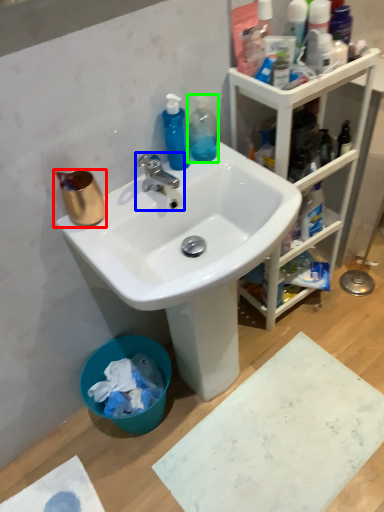
Question: Considering the real-world distances, which object is farthest from coffee cup (highlighted by a red box)? tap (highlighted by a blue box) or cleaning product (highlighted by a green box)?

Choices:
 (A) tap
 (B) cleaning product

Answer: (B)